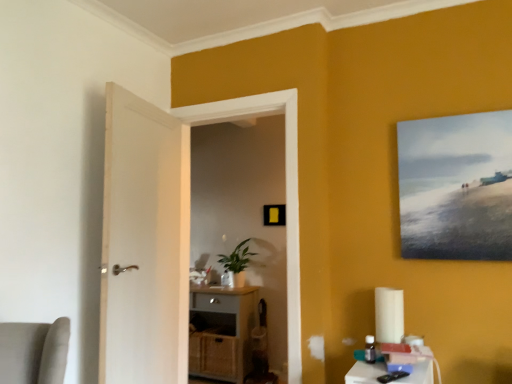
Find the location of a particular element. This screenshot has width=512, height=384. matte white door at center is located at coordinates (285, 190).

Image resolution: width=512 pixels, height=384 pixels. Describe the element at coordinates (274, 215) in the screenshot. I see `matte black picture frame at center, the 2th picture frame in the right-to-left sequence` at that location.

This screenshot has height=384, width=512. I want to click on white plastic table at lower right, so click(x=415, y=365).

Find the location of a particular element. green matte plant at center is located at coordinates (236, 265).

Identify the location of matte white door at center. (285, 190).

From the image's perspective, who appears lower, matte gray cabinet at center or white plastic table at lower right?

matte gray cabinet at center, from the image's perspective.

Which object is positioned more to the left, matte gray cabinet at center or white plastic table at lower right?

Positioned to the left is matte gray cabinet at center.

Would you consider matte gray cabinet at center to be distant from white plastic table at lower right?

Yes, matte gray cabinet at center and white plastic table at lower right are quite far apart.

Considering the sizes of objects matte gray cabinet at center and white plastic table at lower right in the image provided, who is taller, matte gray cabinet at center or white plastic table at lower right?

With more height is matte gray cabinet at center.

Could you tell me if white plastic table at lower right is facing matte black picture frame at center, the first picture frame in the back-to-front sequence?

No, white plastic table at lower right does not turn towards matte black picture frame at center, the first picture frame in the back-to-front sequence.

Considering the points (426, 365) and (267, 214), which point is behind, point (426, 365) or point (267, 214)?

The point (267, 214) is farther from the camera.

Does white plastic table at lower right have a larger size compared to matte black picture frame at center, the second picture frame in the front-to-back sequence?

Yes.

Is green matte plant at center positioned beyond the bounds of matte canvas painting at upper right, which is the 2th picture frame from back to front?

That's correct, green matte plant at center is outside of matte canvas painting at upper right, which is the 2th picture frame from back to front.

Between green matte plant at center and matte canvas painting at upper right, the first picture frame when ordered from right to left, which one has less height?

With less height is green matte plant at center.

Is point (229, 271) positioned after point (421, 150)?

Yes.

Which object is further away from the camera taking this photo, green matte plant at center or matte canvas painting at upper right, which is the 2th picture frame from back to front?

green matte plant at center is more distant.

Which is in front, point (286, 163) or point (419, 235)?

The point (419, 235) is in front.

Can you confirm if matte white door at center is smaller than matte canvas painting at upper right, which is the 2th picture frame from back to front?

No, matte white door at center is not smaller than matte canvas painting at upper right, which is the 2th picture frame from back to front.

From a real-world perspective, is matte white door at center physically located above or below matte canvas painting at upper right, which is the 2th picture frame from back to front?

matte white door at center is below matte canvas painting at upper right, which is the 2th picture frame from back to front.

Is the surface of matte white door at center in direct contact with matte canvas painting at upper right, the second picture frame viewed from the left?

No.

From a real-world perspective, who is located lower, matte black picture frame at center, which appears as the 1th picture frame when viewed from the left, or green matte plant at center?

In real-world perspective, green matte plant at center is lower.

Based on the photo, from the image's perspective, is matte black picture frame at center, the second picture frame in the front-to-back sequence, on green matte plant at center?

Indeed, from the image's perspective, matte black picture frame at center, the second picture frame in the front-to-back sequence, is shown above green matte plant at center.

Is point (274, 206) in front of point (233, 259)?

Yes, point (274, 206) is closer to viewer.

Which of these two, matte black picture frame at center, which appears as the 1th picture frame when viewed from the left, or green matte plant at center, stands shorter?

Standing shorter between the two is matte black picture frame at center, which appears as the 1th picture frame when viewed from the left.

Which of these two, matte gray cabinet at center or matte canvas painting at upper right, the second picture frame viewed from the left, is smaller?

With smaller size is matte canvas painting at upper right, the second picture frame viewed from the left.

In the image, is matte gray cabinet at center on the left side or the right side of matte canvas painting at upper right, the second picture frame viewed from the left?

matte gray cabinet at center is to the left of matte canvas painting at upper right, the second picture frame viewed from the left.

Which is behind, point (240, 325) or point (443, 243)?

Positioned behind is point (240, 325).

Are green matte plant at center and matte black picture frame at center, the 2th picture frame in the right-to-left sequence, beside each other?

green matte plant at center and matte black picture frame at center, the 2th picture frame in the right-to-left sequence, are clearly separated.

Which is in front, point (242, 251) or point (265, 212)?

Point (265, 212)

Does green matte plant at center have a smaller size compared to matte black picture frame at center, the first picture frame in the back-to-front sequence?

Actually, green matte plant at center might be larger than matte black picture frame at center, the first picture frame in the back-to-front sequence.

Based on the photo, from a real-world perspective, is green matte plant at center over matte black picture frame at center, which appears as the 1th picture frame when viewed from the left?

No, from a real-world perspective, green matte plant at center is not over matte black picture frame at center, which appears as the 1th picture frame when viewed from the left

The image size is (512, 384). In order to click on cabinetry lying on the left of white plastic table at lower right in this screenshot , I will do `click(222, 332)`.

What are the coordinates of `table below the matte black picture frame at center, the second picture frame in the front-to-back sequence (from a real-world perspective)` in the screenshot? It's located at (415, 365).

Estimate the real-world distances between objects in this image. Which object is closer to white plastic table at lower right, matte gray cabinet at center or matte black picture frame at center, the 2th picture frame in the right-to-left sequence?

Based on the image, matte gray cabinet at center appears to be nearer to white plastic table at lower right.

When comparing their distances from matte gray cabinet at center, does green matte plant at center or white plastic table at lower right seem further?

white plastic table at lower right is further to matte gray cabinet at center.

Which object lies further to the anchor point matte canvas painting at upper right, the first picture frame when ordered from right to left, green matte plant at center or matte gray cabinet at center?

green matte plant at center is further to matte canvas painting at upper right, the first picture frame when ordered from right to left.

Which object lies nearer to the anchor point matte gray cabinet at center, matte canvas painting at upper right, the first picture frame when ordered from right to left, or matte black picture frame at center, the second picture frame in the front-to-back sequence?

matte black picture frame at center, the second picture frame in the front-to-back sequence, lies closer to matte gray cabinet at center than the other object.

Looking at the image, which one is located further to green matte plant at center, matte canvas painting at upper right, which is the 2th picture frame from back to front, or matte gray cabinet at center?

matte canvas painting at upper right, which is the 2th picture frame from back to front, is positioned further to the anchor green matte plant at center.

Estimate the real-world distances between objects in this image. Which object is closer to matte white door at center, matte black picture frame at center, which appears as the 1th picture frame when viewed from the left, or matte canvas painting at upper right, which is the 2th picture frame from back to front?

The object closer to matte white door at center is matte canvas painting at upper right, which is the 2th picture frame from back to front.

Based on their spatial positions, is green matte plant at center or matte black picture frame at center, the first picture frame in the back-to-front sequence, closer to matte canvas painting at upper right, which is the 2th picture frame from back to front?

matte black picture frame at center, the first picture frame in the back-to-front sequence, lies closer to matte canvas painting at upper right, which is the 2th picture frame from back to front, than the other object.

Looking at the image, which one is located closer to matte white door at center, white plastic table at lower right or green matte plant at center?

white plastic table at lower right lies closer to matte white door at center than the other object.

Where is `picture frame between white plastic table at lower right and matte black picture frame at center, the 2th picture frame in the right-to-left sequence, along the z-axis`? The height and width of the screenshot is (384, 512). picture frame between white plastic table at lower right and matte black picture frame at center, the 2th picture frame in the right-to-left sequence, along the z-axis is located at coordinates (456, 187).

I want to click on picture frame between white plastic table at lower right and matte gray cabinet at center from front to back, so click(456, 187).

You are a GUI agent. You are given a task and a screenshot of the screen. Output one action in this format:
    pyautogui.click(x=<x>, y=<y>)
    Task: Click on the houseplant between matte white door at center and matte black picture frame at center, the second picture frame in the front-to-back sequence, in the front-back direction
    The width and height of the screenshot is (512, 384).
    Given the screenshot: What is the action you would take?
    pyautogui.click(x=236, y=265)

The image size is (512, 384). I want to click on window between white plastic table at lower right and green matte plant at center in the front-back direction, so click(x=285, y=190).